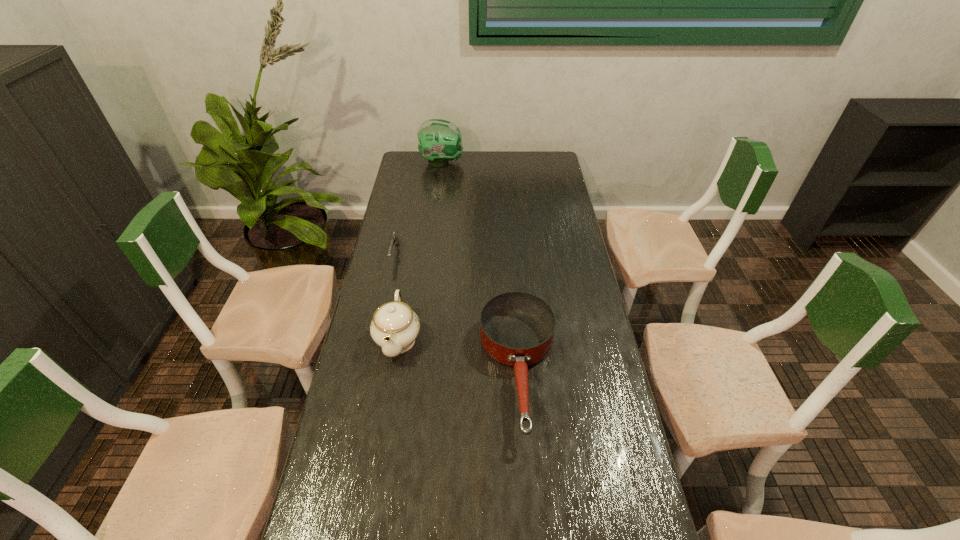
You are a GUI agent. You are given a task and a screenshot of the screen. Output one action in this format:
    pyautogui.click(x=<x>, y=<y>)
    Task: Click on the free space located 0.390m aiming along the barrel of the second farthest object
    The height and width of the screenshot is (540, 960).
    Given the screenshot: What is the action you would take?
    pyautogui.click(x=373, y=354)

The image size is (960, 540). I want to click on object located at the far edge, so click(440, 141).

Image resolution: width=960 pixels, height=540 pixels. Identify the location of football helmet present at the left edge. (440, 141).

Locate an element on the screen. This screenshot has height=540, width=960. chinaware at the left edge is located at coordinates (395, 326).

The image size is (960, 540). I want to click on gun that is positioned at the left edge, so pyautogui.click(x=394, y=239).

The width and height of the screenshot is (960, 540). Identify the location of object that is at the far left corner. (440, 141).

This screenshot has width=960, height=540. In order to click on vacant area at the far edge of the desktop in this screenshot , I will do `click(482, 173)`.

This screenshot has width=960, height=540. What are the coordinates of `free location at the left edge` in the screenshot? It's located at (355, 345).

Find the location of `vacant area at the right edge of the desktop`. vacant area at the right edge of the desktop is located at coordinates (583, 274).

Identify the location of vacant space at the far right corner of the desktop. The width and height of the screenshot is (960, 540). (544, 153).